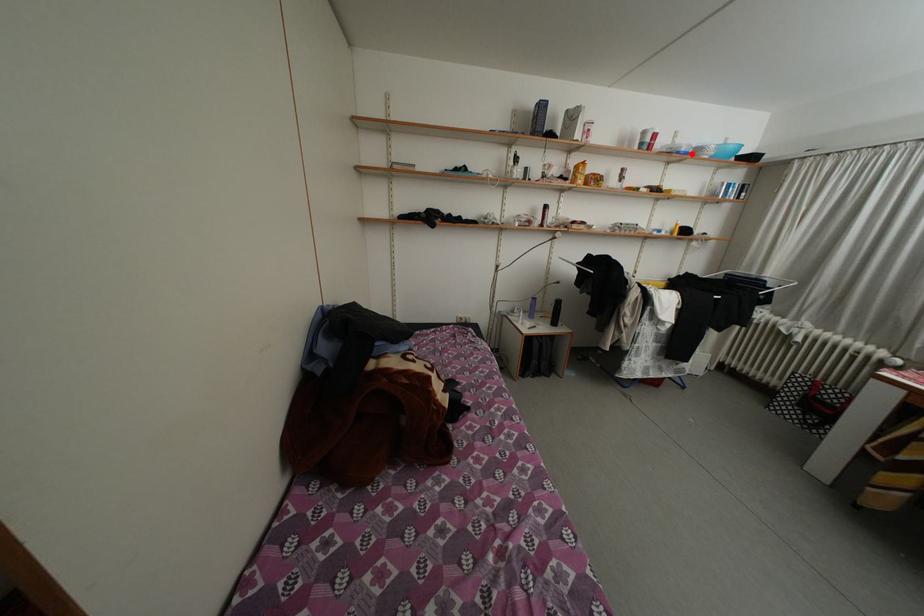
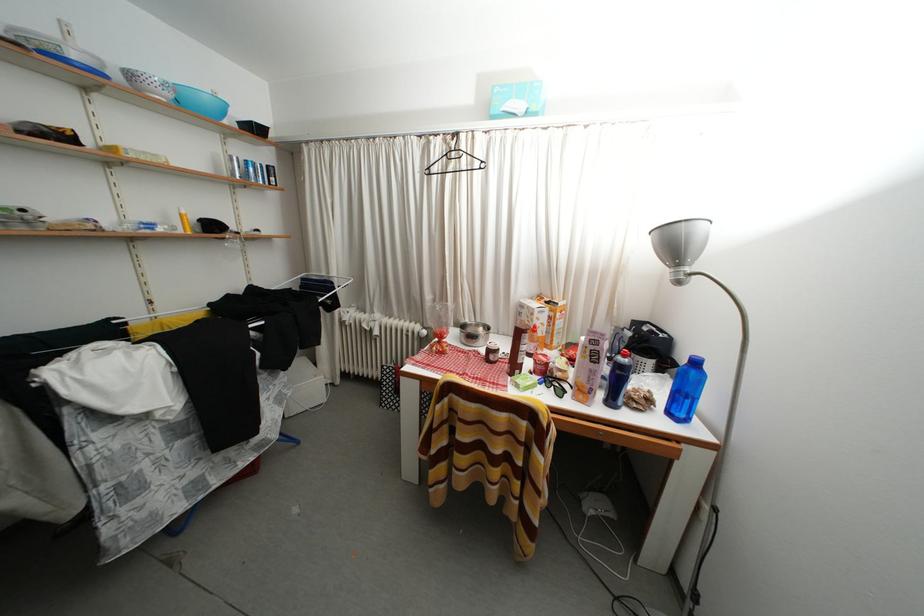
In the second image, find the point that corresponds to the highlighted location in the first image.

(81, 61)